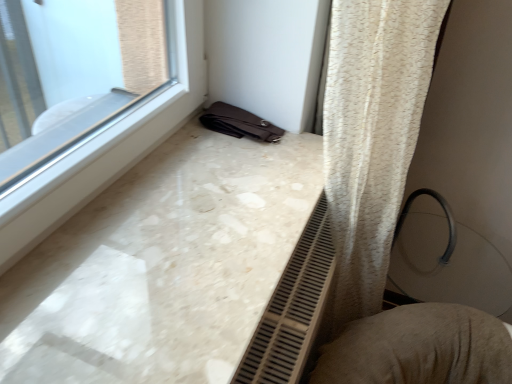
Question: From a real-world perspective, is textured beige cushion at lower right located higher than white marble counter top at lower left?

Choices:
 (A) no
 (B) yes

Answer: (A)

Question: Considering the relative sizes of textured beige cushion at lower right and white marble counter top at lower left in the image provided, is textured beige cushion at lower right thinner than white marble counter top at lower left?

Choices:
 (A) no
 (B) yes

Answer: (B)

Question: Is textured beige cushion at lower right further to camera compared to white marble counter top at lower left?

Choices:
 (A) yes
 (B) no

Answer: (A)

Question: Is textured beige cushion at lower right bigger than white marble counter top at lower left?

Choices:
 (A) no
 (B) yes

Answer: (B)

Question: Can you confirm if textured beige cushion at lower right is smaller than white marble counter top at lower left?

Choices:
 (A) no
 (B) yes

Answer: (A)

Question: From the image's perspective, is textured beige cushion at lower right below white marble counter top at lower left?

Choices:
 (A) yes
 (B) no

Answer: (A)

Question: From the image's perspective, does white marble counter top at lower left appear higher than textured beige cushion at lower right?

Choices:
 (A) yes
 (B) no

Answer: (A)

Question: From a real-world perspective, is white marble counter top at lower left below textured beige cushion at lower right?

Choices:
 (A) no
 (B) yes

Answer: (A)

Question: From a real-world perspective, is white marble counter top at lower left located higher than textured beige cushion at lower right?

Choices:
 (A) yes
 (B) no

Answer: (A)

Question: Does white marble counter top at lower left have a lesser height compared to textured beige cushion at lower right?

Choices:
 (A) no
 (B) yes

Answer: (B)

Question: Considering the relative positions of white marble counter top at lower left and textured beige cushion at lower right in the image provided, is white marble counter top at lower left behind textured beige cushion at lower right?

Choices:
 (A) yes
 (B) no

Answer: (B)

Question: Is white marble counter top at lower left surrounding textured beige cushion at lower right?

Choices:
 (A) yes
 (B) no

Answer: (B)

Question: Looking at the image, does textured beige cushion at lower right seem bigger or smaller compared to white marble counter top at lower left?

Choices:
 (A) small
 (B) big

Answer: (B)